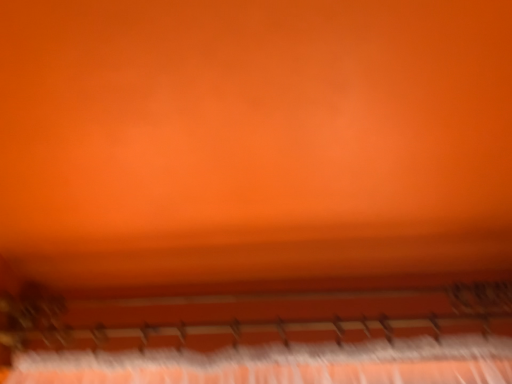
Question: In which direction should I rotate to look at metallic silver musical keyboard at lower center?

Choices:
 (A) right
 (B) left

Answer: (A)

Question: Should I look upward or downward to see metallic silver musical keyboard at lower center?

Choices:
 (A) down
 (B) up

Answer: (A)